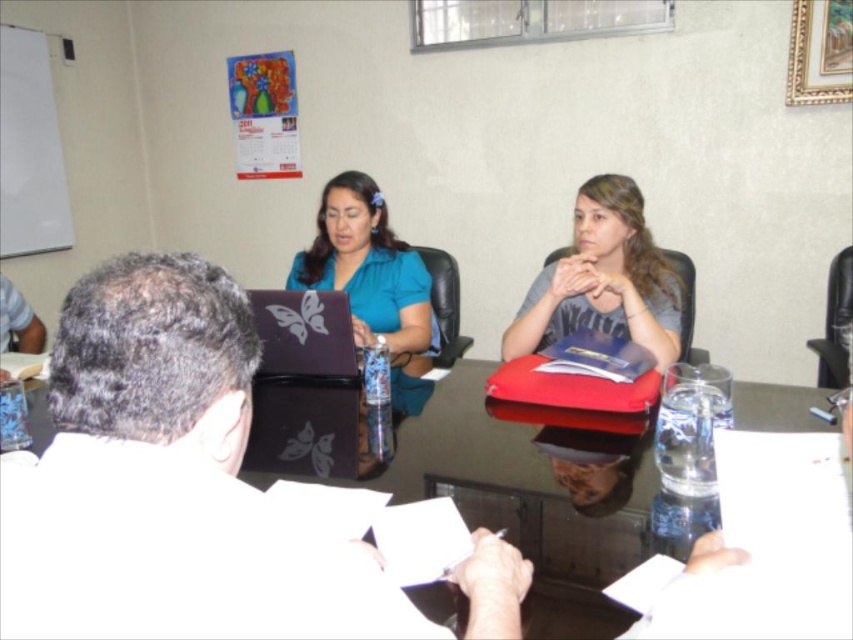
You are a person who is 5 feet 6 inches tall. You are standing in front of the transparent glass table at center. Can you see your entire body reflected in the table?

The transparent glass table at center is 20.36 inches away from the viewer. Since the table is glass and transparent, reflections depend on lighting conditions. However, the distance alone does not guarantee a full reflection of your body. The angle of incidence and the table surface quality also play roles. Without specific info on lighting and surface, we can only state the distance.

You are standing in the conference room and want to place a large document on the transparent glass table at center. Based on its 2D coordinates, where exactly should you aim to place the document?

The transparent glass table at center is located at the 2D coordinates point (747, 605), so you should aim for that specific point to place the document there.

You are a conference attendee who needs to pass a document from the matte gray folder at center to the person using the matte black laptop at center. Can you do this without moving either object?

The distance between the matte gray folder at center and the matte black laptop at center is 25.86 inches. If the person can reach across this distance, they might be able to pass the document without moving the objects. However, typical arm reach might be shorter, so it could require some stretching or adjusting positions.